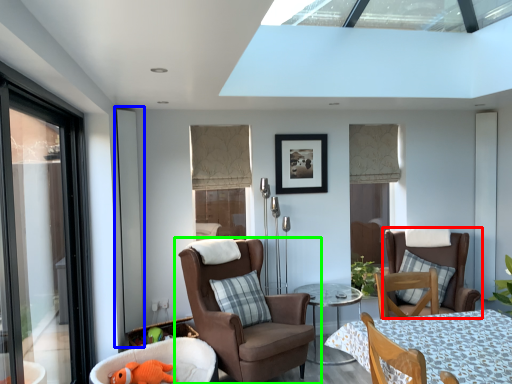
Question: Based on their relative distances, which object is nearer to chair (highlighted by a red box)? Choose from screen door (highlighted by a blue box) and chair (highlighted by a green box).

Choices:
 (A) screen door
 (B) chair

Answer: (B)